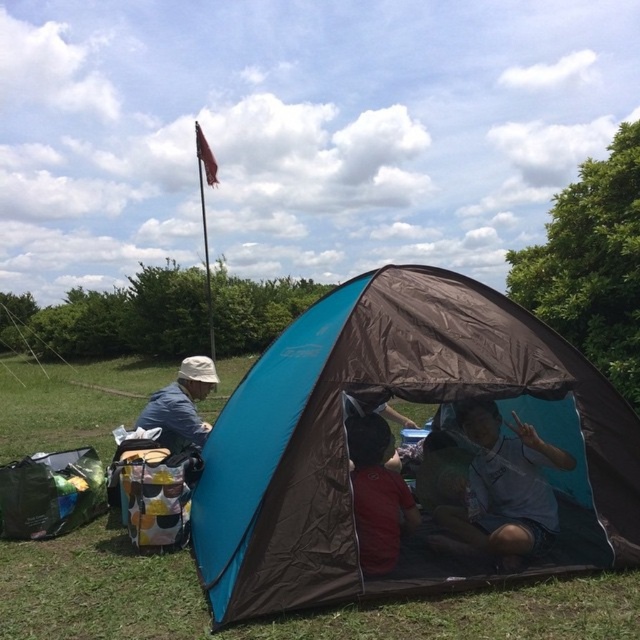
Question: Does brown/tarpaulin tent at center have a smaller size compared to red matte shirt at center?

Choices:
 (A) yes
 (B) no

Answer: (B)

Question: Which object is positioned farthest from the matte blue tent at center?

Choices:
 (A) red matte shirt at center
 (B) matte blue shirt at left

Answer: (B)

Question: Can you confirm if brown/tarpaulin tent at center is thinner than matte blue tent at center?

Choices:
 (A) yes
 (B) no

Answer: (B)

Question: Which of the following is the closest to the observer?

Choices:
 (A) pyautogui.click(x=172, y=419)
 (B) pyautogui.click(x=520, y=376)
 (C) pyautogui.click(x=472, y=472)
 (D) pyautogui.click(x=410, y=493)

Answer: (B)

Question: Estimate the real-world distances between objects in this image. Which object is closer to the matte blue shirt at left?

Choices:
 (A) red matte shirt at center
 (B) matte blue tent at center

Answer: (A)

Question: Can you confirm if brown/tarpaulin tent at center is bigger than red matte shirt at center?

Choices:
 (A) yes
 (B) no

Answer: (A)